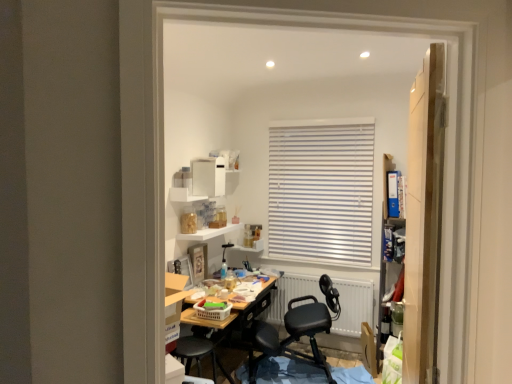
Question: Can we say white matte shelf at upper center, marked as the 1th shelf in a bottom-to-top arrangement, lies outside plastic laundry basket at center?

Choices:
 (A) no
 (B) yes

Answer: (B)

Question: Does white matte shelf at upper center, which is counted as the 2th shelf, starting from the top, have a lesser width compared to plastic laundry basket at center?

Choices:
 (A) yes
 (B) no

Answer: (A)

Question: Is white matte shelf at upper center, marked as the 1th shelf in a bottom-to-top arrangement, bigger than plastic laundry basket at center?

Choices:
 (A) no
 (B) yes

Answer: (B)

Question: From a real-world perspective, is white matte shelf at upper center, which is counted as the 2th shelf, starting from the top, on top of plastic laundry basket at center?

Choices:
 (A) no
 (B) yes

Answer: (B)

Question: From the image's perspective, is white matte shelf at upper center, which is counted as the 2th shelf, starting from the top, located beneath plastic laundry basket at center?

Choices:
 (A) yes
 (B) no

Answer: (B)

Question: From the image's perspective, is white glossy shelf at upper center, acting as the second shelf starting from the bottom, positioned above or below white matte shelf at upper center, which is counted as the 2th shelf, starting from the top?

Choices:
 (A) above
 (B) below

Answer: (A)

Question: Is point (196, 198) closer or farther from the camera than point (183, 238)?

Choices:
 (A) farther
 (B) closer

Answer: (A)

Question: Considering their positions, is white glossy shelf at upper center, the first shelf positioned from the top, located in front of or behind white matte shelf at upper center, which is counted as the 2th shelf, starting from the top?

Choices:
 (A) behind
 (B) front

Answer: (B)

Question: Looking at their shapes, would you say white glossy shelf at upper center, the first shelf positioned from the top, is wider or thinner than white matte shelf at upper center, which is counted as the 2th shelf, starting from the top?

Choices:
 (A) thin
 (B) wide

Answer: (A)

Question: Is white matte shelf at upper center, marked as the 1th shelf in a bottom-to-top arrangement, spatially inside white glossy shelf at upper center, acting as the second shelf starting from the bottom, or outside of it?

Choices:
 (A) outside
 (B) inside

Answer: (A)

Question: Considering the positions of white matte shelf at upper center, which is counted as the 2th shelf, starting from the top, and white glossy shelf at upper center, the first shelf positioned from the top, in the image, is white matte shelf at upper center, which is counted as the 2th shelf, starting from the top, taller or shorter than white glossy shelf at upper center, the first shelf positioned from the top,?

Choices:
 (A) short
 (B) tall

Answer: (A)

Question: Is point (199, 233) positioned closer to the camera than point (185, 195)?

Choices:
 (A) farther
 (B) closer

Answer: (A)

Question: Considering the relative positions of white matte shelf at upper center, which is counted as the 2th shelf, starting from the top, and white glossy shelf at upper center, acting as the second shelf starting from the bottom, in the image provided, is white matte shelf at upper center, which is counted as the 2th shelf, starting from the top, to the left or to the right of white glossy shelf at upper center, acting as the second shelf starting from the bottom,?

Choices:
 (A) right
 (B) left

Answer: (A)

Question: Do you think black leather office chair at center is within white glossy shelf at upper center, the first shelf positioned from the top, or outside of it?

Choices:
 (A) inside
 (B) outside

Answer: (B)

Question: From the image's perspective, relative to white glossy shelf at upper center, the first shelf positioned from the top, is black leather office chair at center above or below?

Choices:
 (A) above
 (B) below

Answer: (B)